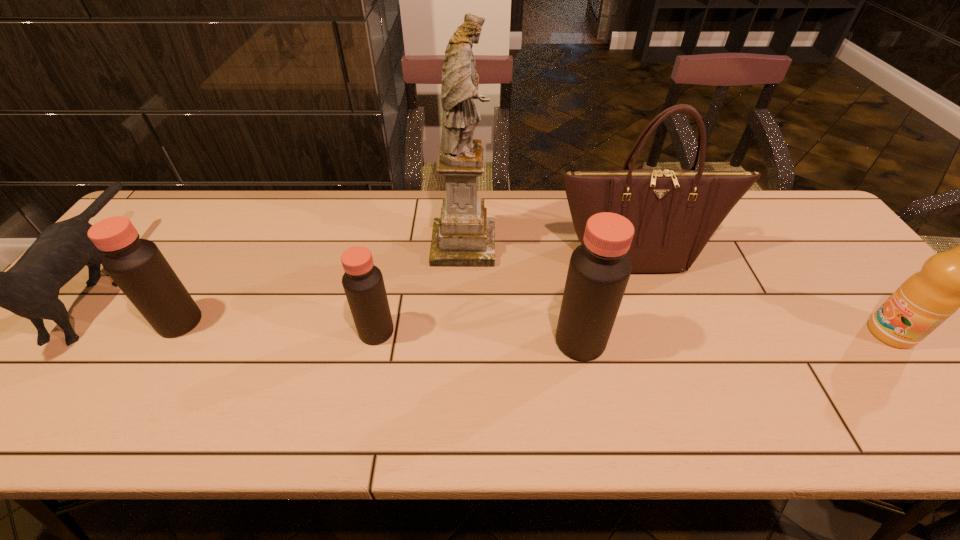
The width and height of the screenshot is (960, 540). In the image, there is a desktop. Find the location of `vacant space at the right edge`. vacant space at the right edge is located at coordinates (896, 350).

You are a GUI agent. You are given a task and a screenshot of the screen. Output one action in this format:
    pyautogui.click(x=<x>, y=<y>)
    Task: Click on the free space at the far left corner of the desktop
    
    Given the screenshot: What is the action you would take?
    pyautogui.click(x=204, y=195)

Where is `vacant space at the near right corner`? Image resolution: width=960 pixels, height=540 pixels. vacant space at the near right corner is located at coordinates (890, 374).

Where is `vacant area between the fruit juice and the fifth object from right to left`? vacant area between the fruit juice and the fifth object from right to left is located at coordinates (634, 332).

This screenshot has height=540, width=960. What are the coordinates of `free space between the sixth shortest object and the sculpture` in the screenshot? It's located at (549, 249).

Locate an element on the screen. Image resolution: width=960 pixels, height=540 pixels. vacant area that lies between the rightmost vinegar and the rightmost object is located at coordinates (735, 337).

Where is `vacant region between the handbag and the sculpture`? vacant region between the handbag and the sculpture is located at coordinates click(549, 249).

Where is `vacant area that lies between the sculpture and the second object from left to right`? vacant area that lies between the sculpture and the second object from left to right is located at coordinates (322, 284).

Where is `vacant space in between the fruit juice and the rightmost vinegar`? The image size is (960, 540). vacant space in between the fruit juice and the rightmost vinegar is located at coordinates tap(735, 337).

Identify the location of empty space that is in between the sculpture and the rightmost object. Image resolution: width=960 pixels, height=540 pixels. click(x=677, y=289).